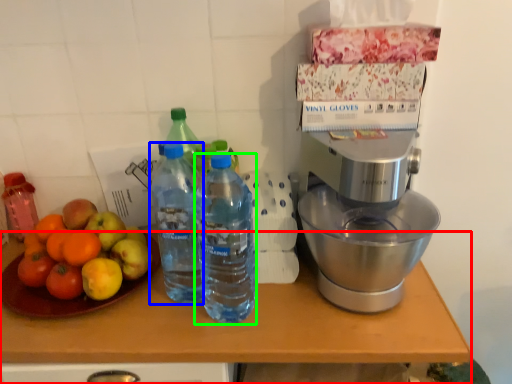
Question: Which object is positioned closest to table (highlighted by a red box)? Select from bottle (highlighted by a blue box) and bottle (highlighted by a green box).

Choices:
 (A) bottle
 (B) bottle

Answer: (B)